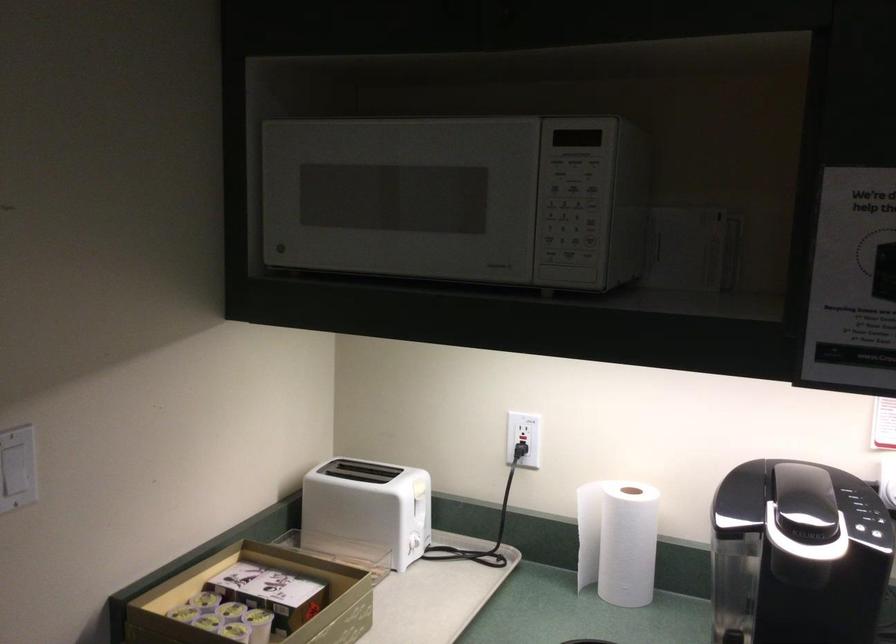
Where would you push the black power plug? Please return your answer as a coordinate pair (x, y).

(521, 456)